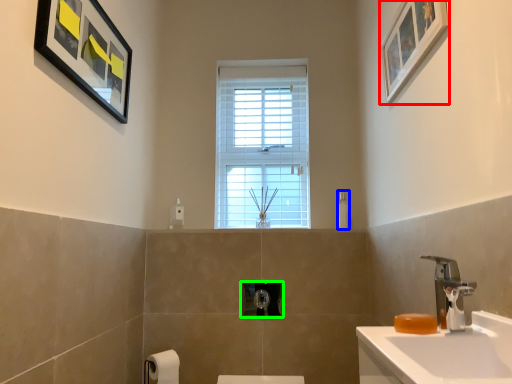
Question: Which object is positioned farthest from picture frame (highlighted by a red box)? Select from soap dispenser (highlighted by a blue box) and towel bar (highlighted by a green box).

Choices:
 (A) soap dispenser
 (B) towel bar

Answer: (B)